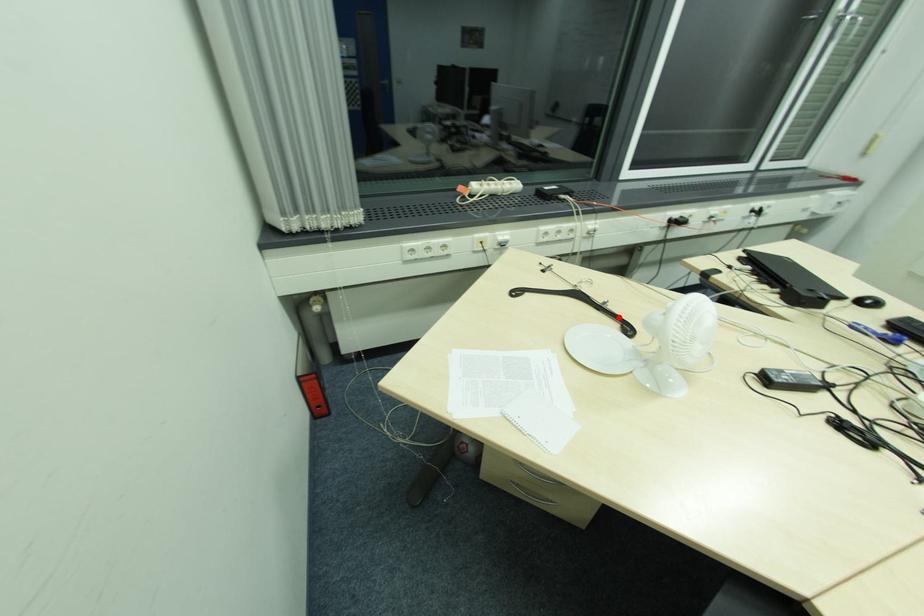
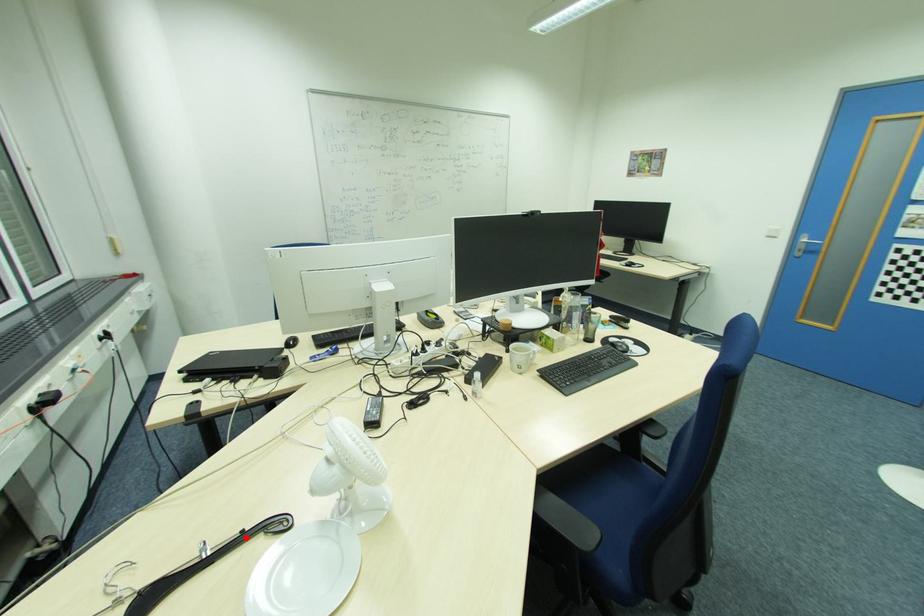
I am providing you with two images of the same scene from different viewpoints. A red point is marked on the first image and another point is marked on the second image. Do the highlighted points in image1 and image2 indicate the same real-world spot?

Yes